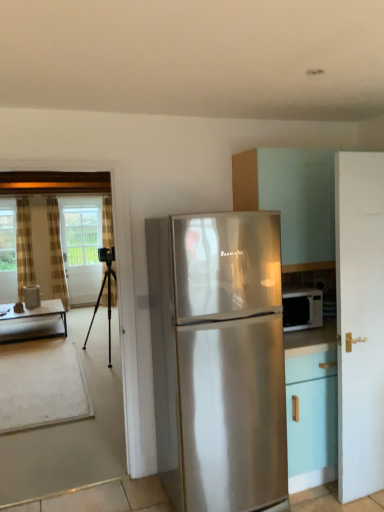
Question: Is white glossy cabinet at upper right to the left of white glossy water at left from the viewer's perspective?

Choices:
 (A) no
 (B) yes

Answer: (A)

Question: Considering the relative sizes of white glossy cabinet at upper right and white glossy water at left in the image provided, is white glossy cabinet at upper right smaller than white glossy water at left?

Choices:
 (A) no
 (B) yes

Answer: (A)

Question: Could you tell me if white glossy cabinet at upper right is facing white glossy water at left?

Choices:
 (A) no
 (B) yes

Answer: (A)

Question: From the image's perspective, is white glossy cabinet at upper right below white glossy water at left?

Choices:
 (A) yes
 (B) no

Answer: (B)

Question: Is white glossy cabinet at upper right outside white glossy water at left?

Choices:
 (A) no
 (B) yes

Answer: (B)

Question: In terms of size, does striped fabric curtain at left, which is the third curtain in right-to-left order, appear bigger or smaller than satin silver refrigerator at center?

Choices:
 (A) small
 (B) big

Answer: (A)

Question: Do you think striped fabric curtain at left, which is the third curtain in right-to-left order, is within satin silver refrigerator at center, or outside of it?

Choices:
 (A) outside
 (B) inside

Answer: (A)

Question: Is point (21, 207) closer or farther from the camera than point (263, 468)?

Choices:
 (A) farther
 (B) closer

Answer: (A)

Question: Is striped fabric curtain at left, acting as the first curtain starting from the left, taller or shorter than satin silver refrigerator at center?

Choices:
 (A) tall
 (B) short

Answer: (A)

Question: From the image's perspective, is black metal tripod at left located above or below plaid fabric curtain at left, which ranks as the third curtain in left-to-right order?

Choices:
 (A) below
 (B) above

Answer: (A)

Question: From a real-world perspective, is black metal tripod at left above or below plaid fabric curtain at left, the first curtain positioned from the right?

Choices:
 (A) below
 (B) above

Answer: (A)

Question: Would you say black metal tripod at left is inside or outside plaid fabric curtain at left, the first curtain positioned from the right?

Choices:
 (A) inside
 (B) outside

Answer: (B)

Question: In terms of height, does black metal tripod at left look taller or shorter compared to plaid fabric curtain at left, the first curtain positioned from the right?

Choices:
 (A) tall
 (B) short

Answer: (B)

Question: From the image's perspective, is white glossy cabinet at upper right positioned above or below satin silver refrigerator at center?

Choices:
 (A) below
 (B) above

Answer: (B)

Question: Is point (259, 148) closer or farther from the camera than point (276, 380)?

Choices:
 (A) farther
 (B) closer

Answer: (A)